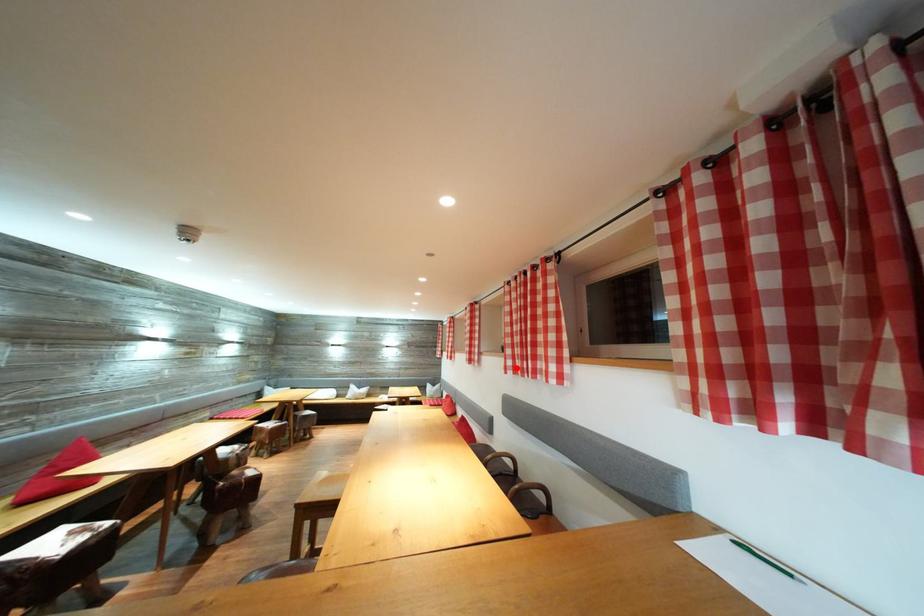
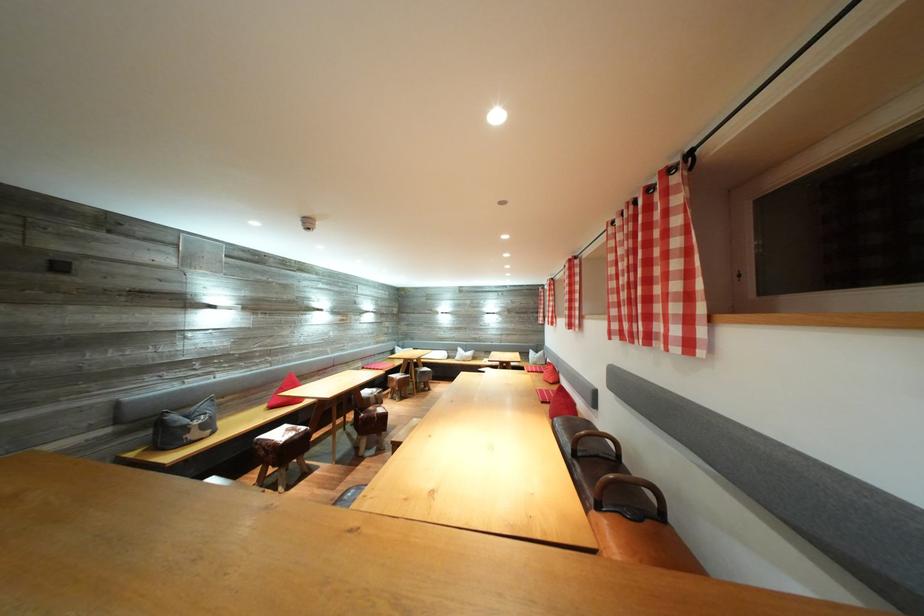
Where in the second image is the point corresponding to the highlighted location from the first image?

(622, 331)